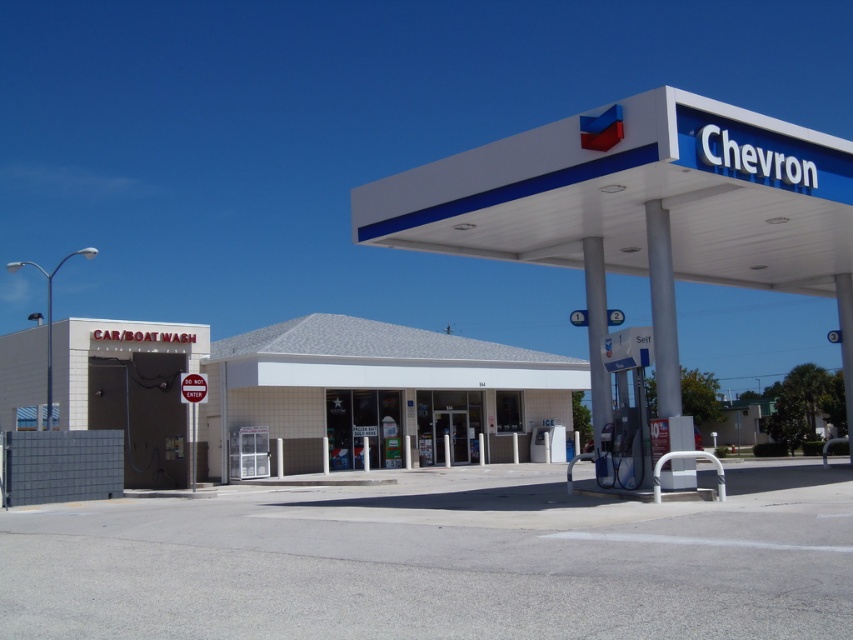
You are driving a delivery truck that is 12 feet wide. You need to park between the white tile building at center and the white tile car wash at lower left. Is there enough space for your truck?

The distance between the white tile building at center and the white tile car wash at lower left is 23.41 feet. Since your truck is 12 feet wide, there is sufficient space to park between them.

Based on the photo, you are standing at the gas station and want to locate two specific points marked on the ground. The first point is at coordinates point (253, 333) and the second point is at point (86, 337). Which point is closer to you?

Point (253, 333) is further to the viewer than point (86, 337), so the second point at (86, 337) is closer to you.